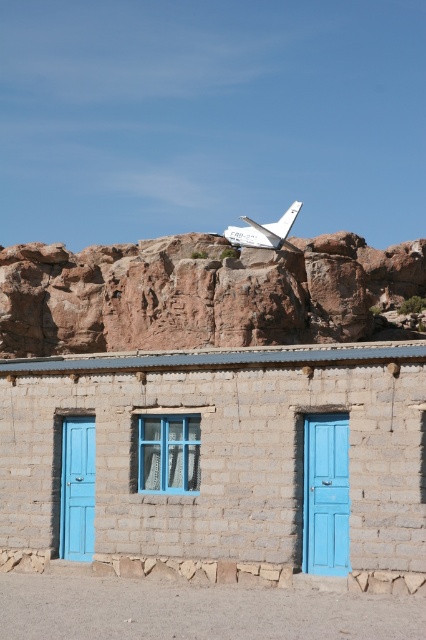
Is point (238, 323) farther from camera compared to point (92, 465)?

Yes.

Looking at this image, is brown rocky cliff at upper center below blue matte door at left?

Actually, brown rocky cliff at upper center is above blue matte door at left.

Who is more distant from viewer, (255, 296) or (77, 426)?

The point (255, 296) is more distant.

The width and height of the screenshot is (426, 640). I want to click on brown rocky cliff at upper center, so click(x=198, y=292).

What do you see at coordinates (198, 292) in the screenshot? I see `brown rocky cliff at upper center` at bounding box center [198, 292].

Who is positioned more to the right, brown rocky cliff at upper center or blue matte door at center?

blue matte door at center is more to the right.

At what (x,y) coordinates should I click in order to perform the action: click on brown rocky cliff at upper center. Please return your answer as a coordinate pair (x, y). Looking at the image, I should click on (198, 292).

The image size is (426, 640). I want to click on brown rocky cliff at upper center, so click(x=198, y=292).

Which is above, brown stone cliff at upper center or blue matte door at left?

brown stone cliff at upper center

Based on the photo, can you confirm if brown stone cliff at upper center is positioned to the right of blue matte door at left?

Indeed, brown stone cliff at upper center is positioned on the right side of blue matte door at left.

Locate an element on the screen. This screenshot has width=426, height=640. brown stone cliff at upper center is located at coordinates (218, 461).